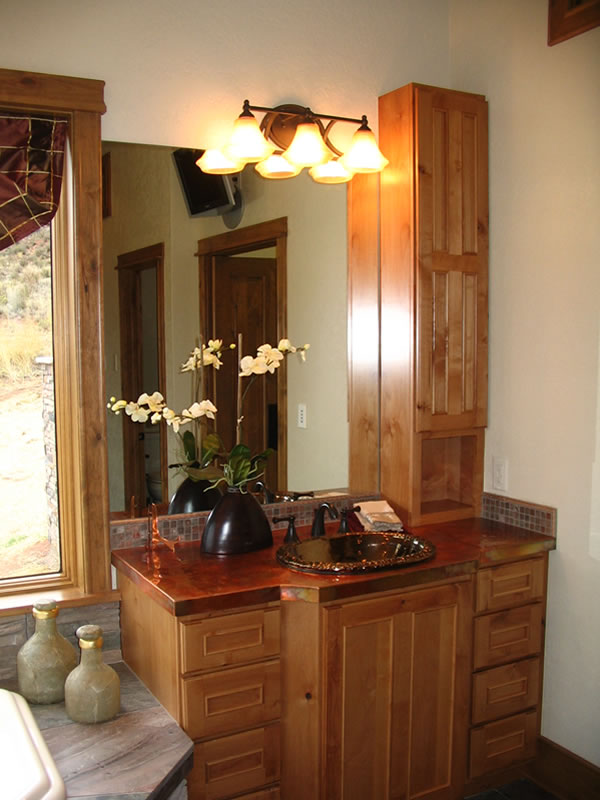
The width and height of the screenshot is (600, 800). Identify the location of decoration 2. (93, 684).